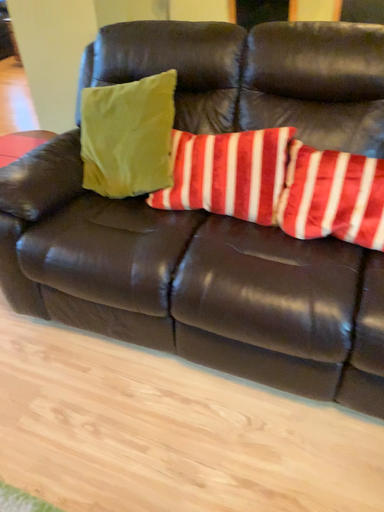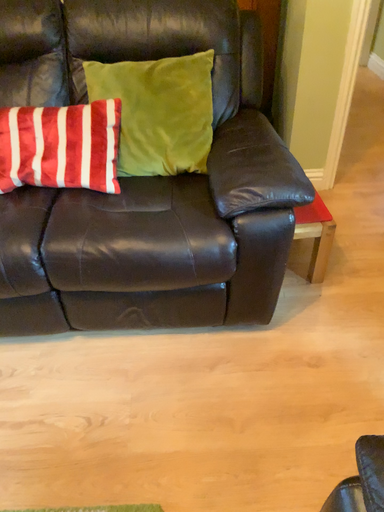
Question: How did the camera likely rotate when shooting the video?

Choices:
 (A) rotated right
 (B) rotated left

Answer: (A)